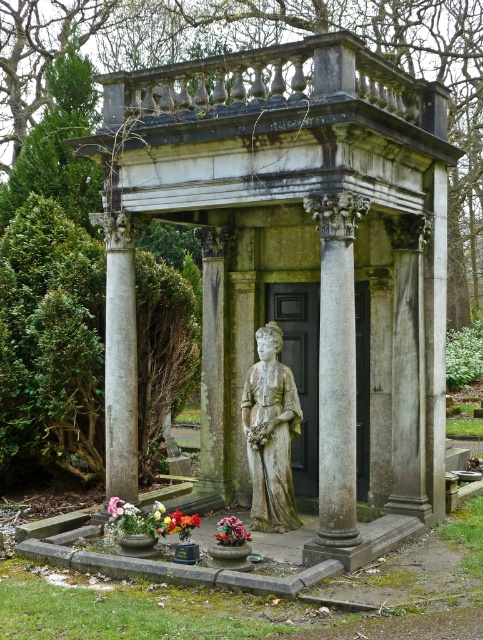
Is gray stone column at center shorter than matte ceramic vase at center?

Incorrect, gray stone column at center's height does not fall short of matte ceramic vase at center's.

Is gray stone column at center wider than matte ceramic vase at center?

Indeed, gray stone column at center has a greater width compared to matte ceramic vase at center.

You are a GUI agent. You are given a task and a screenshot of the screen. Output one action in this format:
    pyautogui.click(x=<x>, y=<y>)
    Task: Click on the gray stone column at center
    
    Given the screenshot: What is the action you would take?
    coord(337,365)

Between gray stone column at center and smooth stone column at center, which one is positioned higher?

smooth stone column at center

How distant is gray stone column at center from smooth stone column at center?

A distance of 7.54 feet exists between gray stone column at center and smooth stone column at center.

Which is in front, point (344, 289) or point (124, 436)?

Point (344, 289)

I want to click on gray stone column at center, so click(337, 365).

Does stone statue at center come behind matte ceramic vase at center?

Yes, stone statue at center is behind matte ceramic vase at center.

Describe the element at coordinates (270, 433) in the screenshot. I see `stone statue at center` at that location.

You are a GUI agent. You are given a task and a screenshot of the screen. Output one action in this format:
    pyautogui.click(x=<x>, y=<y>)
    Task: Click on the stone statue at center
    This screenshot has width=483, height=640.
    Given the screenshot: What is the action you would take?
    pyautogui.click(x=270, y=433)